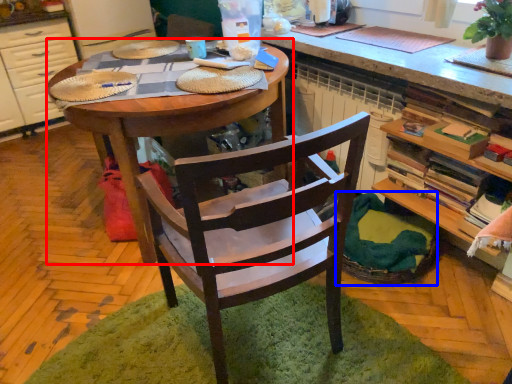
Question: Which point is further to the camera, desk (highlighted by a red box) or basket (highlighted by a blue box)?

Choices:
 (A) desk
 (B) basket

Answer: (B)